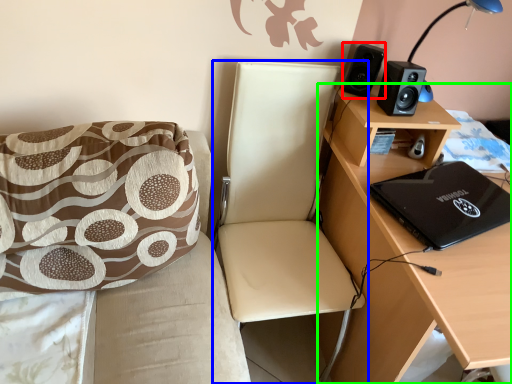
Question: Which is farther away from speaker (highlighted by a red box)? chair (highlighted by a blue box) or desk (highlighted by a green box)?

Choices:
 (A) chair
 (B) desk

Answer: (B)